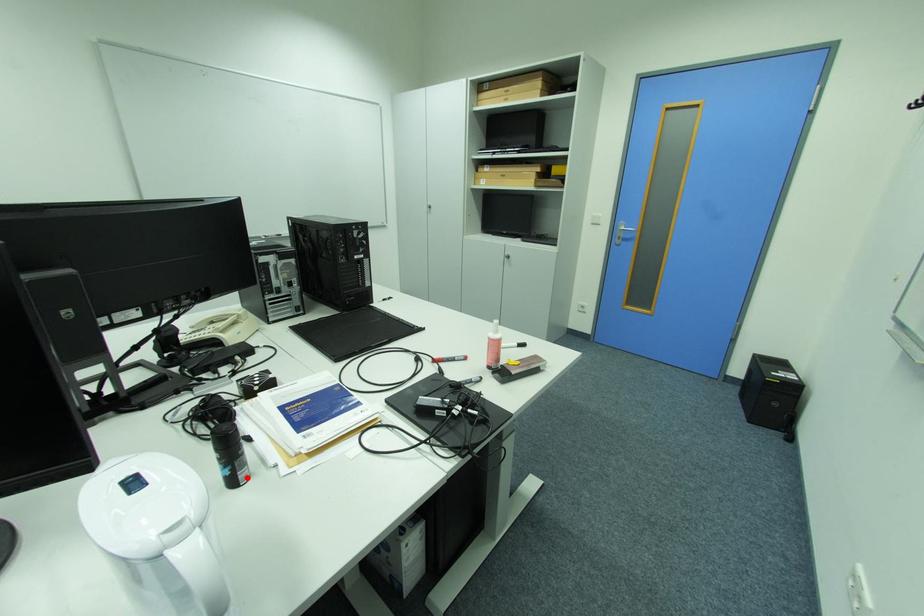
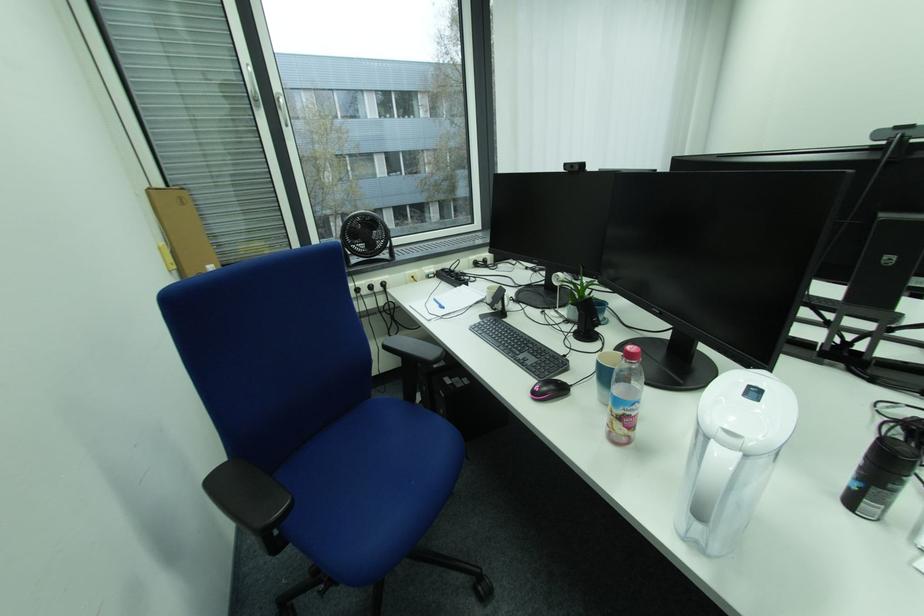
The point at the highlighted location is marked in the first image. Where is the corresponding point in the second image?

(870, 506)